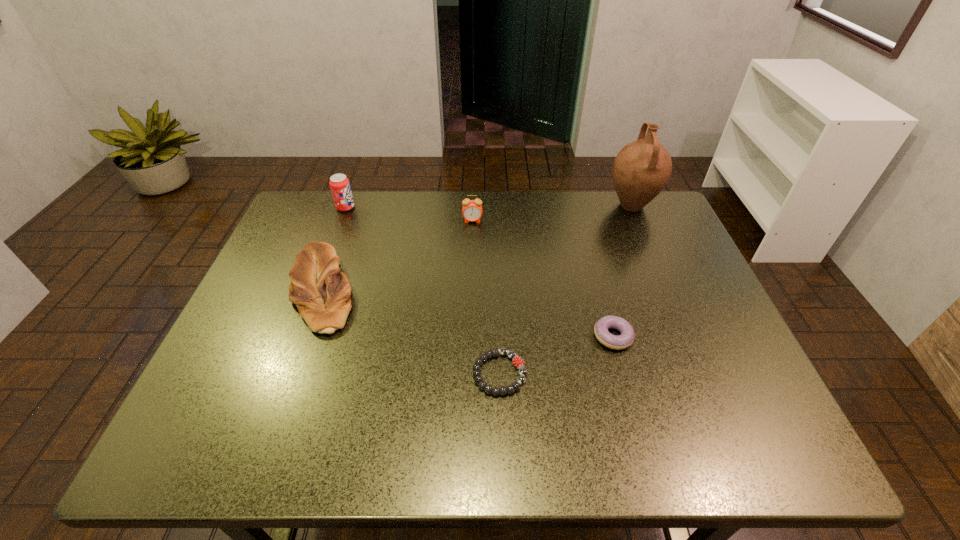
I want to click on vacant region between the third shortest object and the shortest object, so click(412, 332).

At what (x,y) coordinates should I click in order to perform the action: click on unoccupied position between the rightmost object and the alarm clock. Please return your answer as a coordinate pair (x, y). This screenshot has width=960, height=540. Looking at the image, I should click on (552, 213).

Where is `vacant space that is in between the soda can and the alarm clock`? vacant space that is in between the soda can and the alarm clock is located at coordinates (409, 214).

I want to click on unoccupied position between the second tallest object and the second shortest object, so click(x=479, y=272).

At what (x,y) coordinates should I click in order to perform the action: click on vacant region between the alarm clock and the fourth tallest object. Please return your answer as a coordinate pair (x, y). Looking at the image, I should click on (398, 256).

I want to click on empty location between the rightmost object and the shortest object, so click(565, 289).

Locate an element on the screen. The image size is (960, 540). vacant region between the pitcher and the second object from right to left is located at coordinates click(622, 271).

Find the location of a particular element. The image size is (960, 540). the fourth closest object relative to the alarm clock is located at coordinates (627, 336).

Choose which object is the nearest neighbor to the second tallest object. Please provide its 2D coordinates. Your answer should be formatted as a tuple, i.e. [(x, y)], where the tuple contains the x and y coordinates of a point satisfying the conditions above.

[(321, 292)]

Locate an element on the screen. vacant region that satisfies the following two spatial constraints: 1. on the surface of the fifth object from left to right; 2. on the right side of the fifth shortest object is located at coordinates (297, 336).